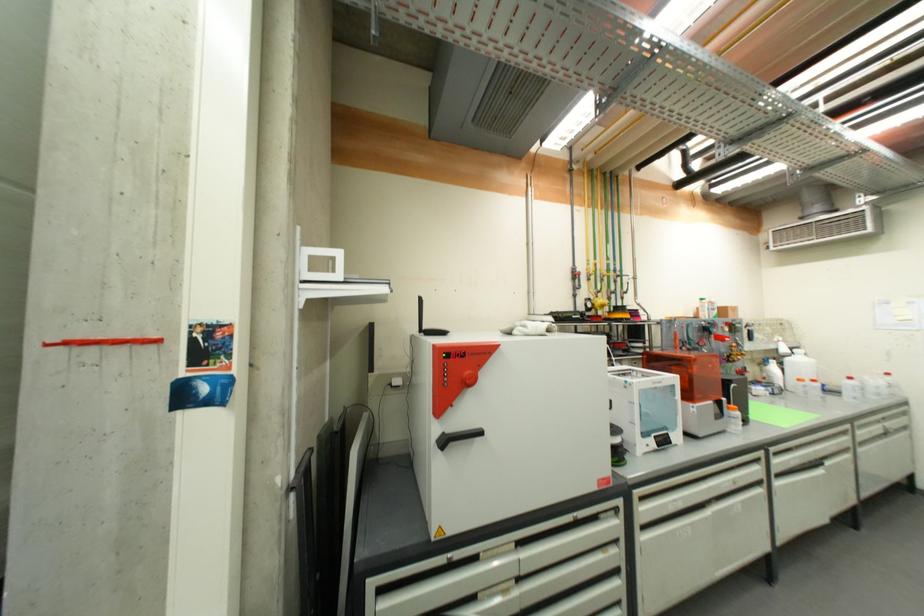
Find where to pull the black oven handle. Please return your answer as a coordinate pair (x, y).

(457, 437)